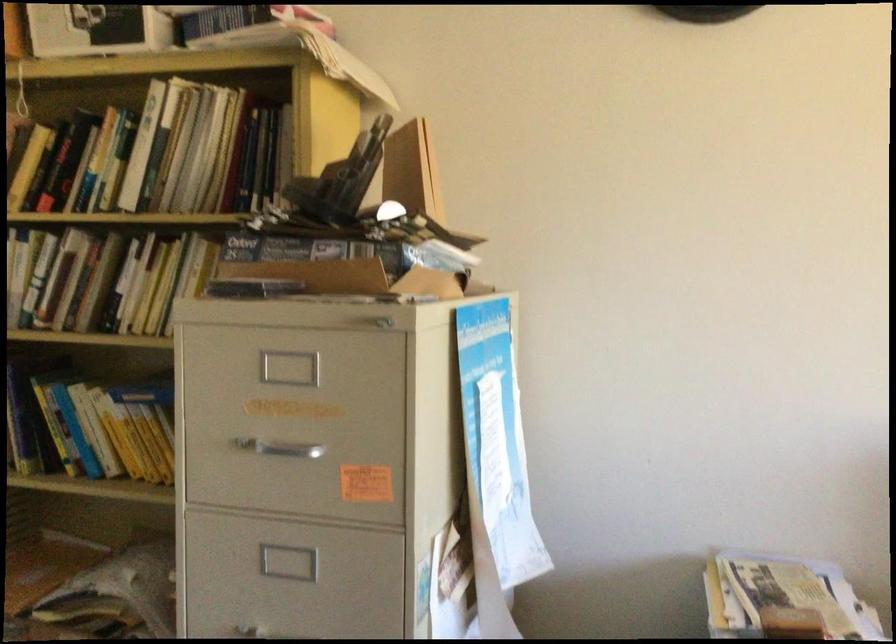
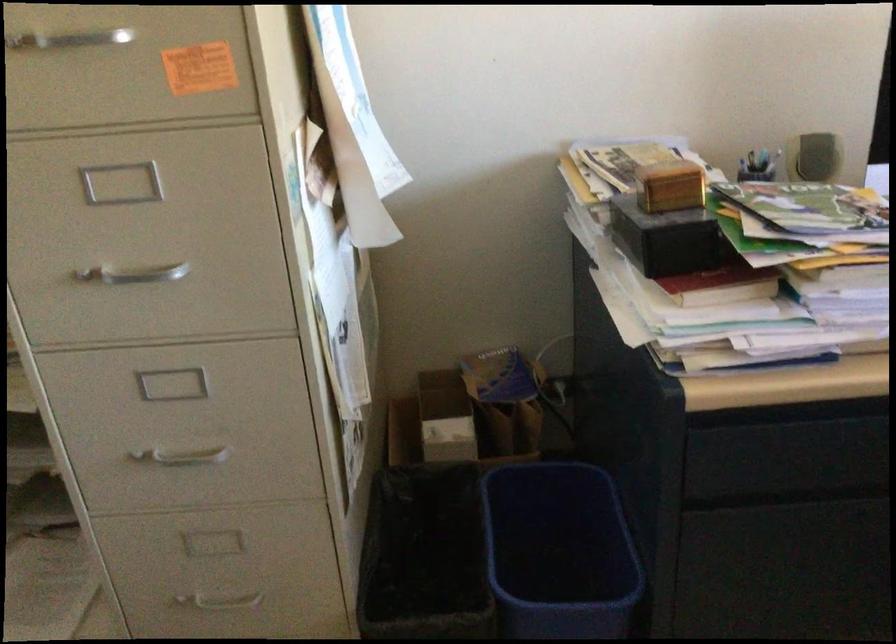
The point at (282,455) is marked in the first image. Where is the corresponding point in the second image?

(67, 40)